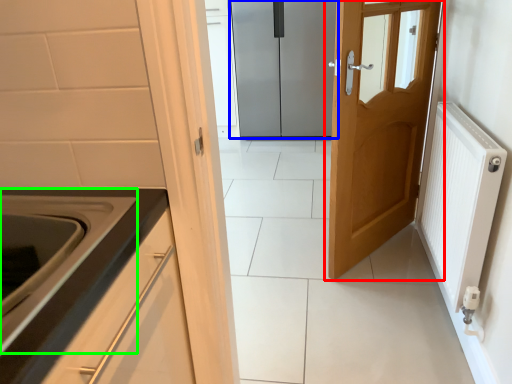
Question: Which is farther away from door (highlighted by a red box)? door (highlighted by a blue box) or oven (highlighted by a green box)?

Choices:
 (A) door
 (B) oven

Answer: (A)